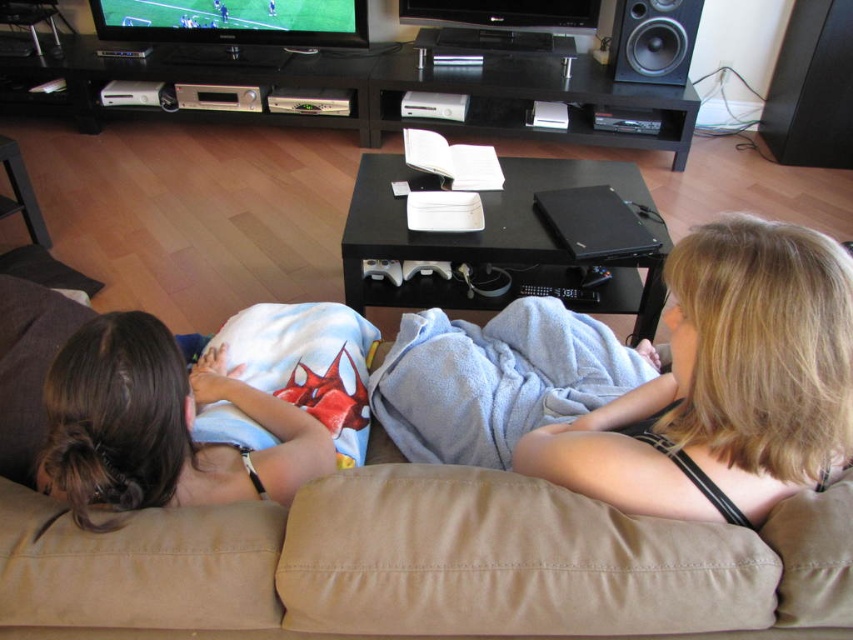
Question: Estimate the real-world distances between objects in this image. Which object is closer to the brown fabric couch at center?

Choices:
 (A) black glossy entertainment center at upper center
 (B) black matte speaker at upper right

Answer: (A)

Question: Which of the following is the closest to the observer?

Choices:
 (A) black matte speaker at upper right
 (B) black glossy entertainment center at upper center
 (C) blonde hair at center

Answer: (C)

Question: In this image, where is blonde hair at center located relative to black matte speaker at upper right?

Choices:
 (A) left
 (B) right

Answer: (A)

Question: From the image, what is the correct spatial relationship of blonde hair at center in relation to light blue fabric blanket at left?

Choices:
 (A) below
 (B) above

Answer: (B)

Question: Which point is closer to the camera?

Choices:
 (A) black matte speaker at upper right
 (B) light blue fabric blanket at left
 (C) brown fabric couch at center
 (D) blonde hair at center

Answer: (D)

Question: Is brown fabric couch at center below black matte speaker at upper right?

Choices:
 (A) yes
 (B) no

Answer: (A)